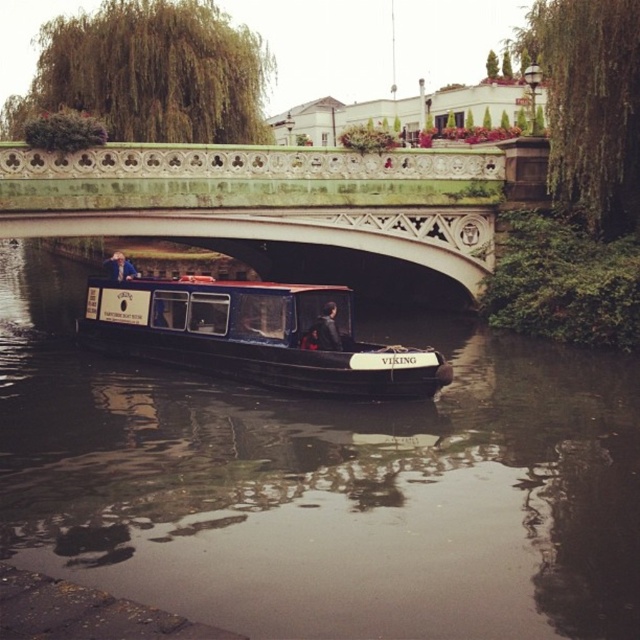
Question: Which point appears closest to the camera in this image?

Choices:
 (A) click(308, 554)
 (B) click(260, 312)
 (C) click(38, 161)

Answer: (A)

Question: Among these points, which one is farthest from the camera?

Choices:
 (A) (301, 188)
 (B) (186, 326)

Answer: (A)

Question: Can you confirm if dark brown water at center is positioned to the right of green stone bridge at upper center?

Choices:
 (A) no
 (B) yes

Answer: (B)

Question: Can you confirm if dark brown water at center is thinner than green stone bridge at upper center?

Choices:
 (A) no
 (B) yes

Answer: (A)

Question: Which point is farther from the camera taking this photo?

Choices:
 (A) (205, 342)
 (B) (442, 426)

Answer: (A)

Question: Is dark brown water at center thinner than green stone bridge at upper center?

Choices:
 (A) no
 (B) yes

Answer: (A)